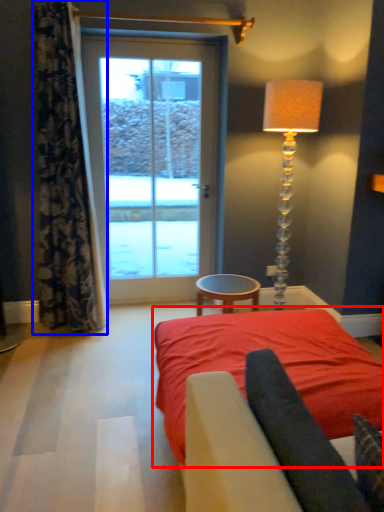
Question: Which point is closer to the camera, bed (highlighted by a red box) or curtain (highlighted by a blue box)?

Choices:
 (A) bed
 (B) curtain

Answer: (A)